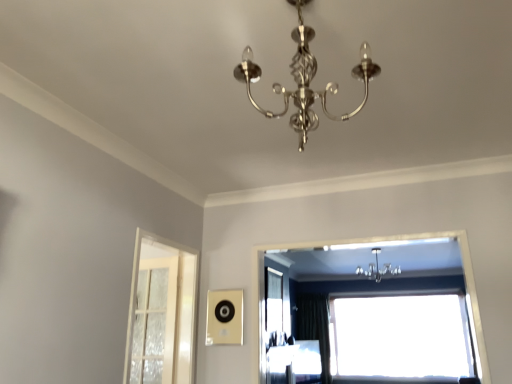
Question: From the image's perspective, is transparent glass window at upper center, placed as the 1th window when sorted from bottom to top, positioned above or below white frosted glass screen door at left?

Choices:
 (A) below
 (B) above

Answer: (A)

Question: Is transparent glass window at upper center, placed as the 1th window when sorted from bottom to top, to the left or to the right of white frosted glass screen door at left in the image?

Choices:
 (A) right
 (B) left

Answer: (A)

Question: Estimate the real-world distances between objects in this image. Which object is farther from the transparent glass window at upper center, which is counted as the second window, starting from the front?

Choices:
 (A) shiny silver chandelier at center
 (B) matte white curtain at lower center
 (C) transparent glass window at center, placed as the 2th window when sorted from bottom to top
 (D) black velvet curtain at center
 (E) metallic chandelier at upper center

Answer: (A)

Question: Estimate the real-world distances between objects in this image. Which object is farther from the black velvet curtain at center?

Choices:
 (A) metallic chandelier at upper center
 (B) white frosted glass screen door at left
 (C) shiny silver chandelier at center
 (D) matte white curtain at lower center
 (E) transparent glass window at upper center, placed as the 1th window when sorted from bottom to top

Answer: (C)